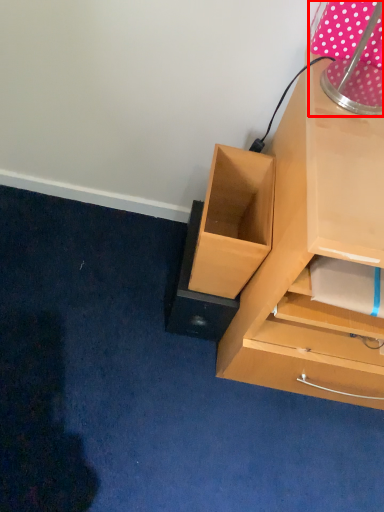
Question: From the image's perspective, where is table lamp (annotated by the red box) located relative to drawer?

Choices:
 (A) above
 (B) below

Answer: (A)